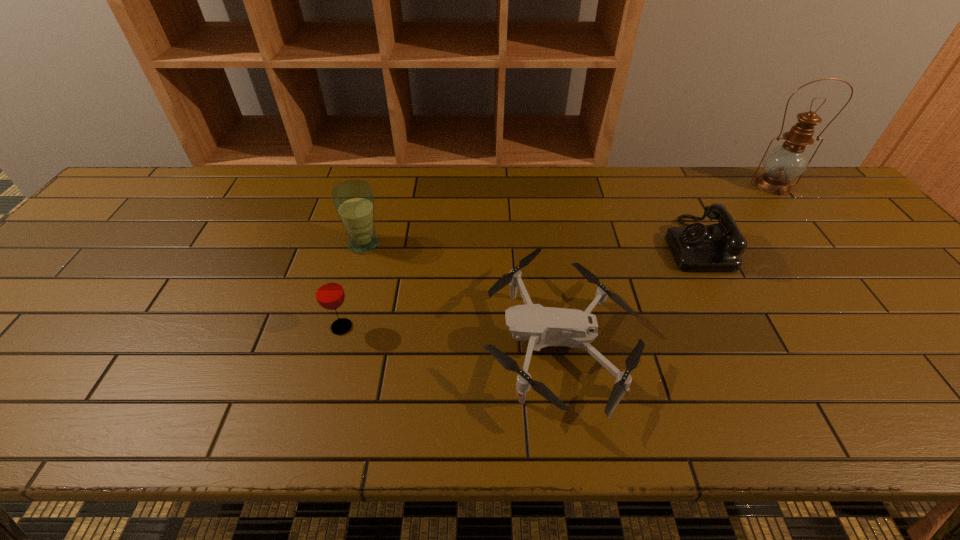
This screenshot has height=540, width=960. In order to click on the tallest object in this screenshot , I will do point(785,162).

The width and height of the screenshot is (960, 540). Find the location of `oil lamp`. oil lamp is located at coordinates (785, 162).

Identify the location of the farther glass. (353, 200).

I want to click on the nearer glass, so [329, 292].

At what (x,y) coordinates should I click in order to perform the action: click on telephone. Please return your answer as a coordinate pair (x, y). Looking at the image, I should click on (696, 247).

The width and height of the screenshot is (960, 540). I want to click on the second shortest object, so click(696, 247).

Image resolution: width=960 pixels, height=540 pixels. Identify the location of the third object from left to right. (543, 326).

Where is `drone`? The width and height of the screenshot is (960, 540). drone is located at coordinates (543, 326).

The width and height of the screenshot is (960, 540). I want to click on free point located 0.390m on the left of the oil lamp, so click(622, 185).

Where is `vacant position located on the back of the farther glass`? The image size is (960, 540). vacant position located on the back of the farther glass is located at coordinates (378, 192).